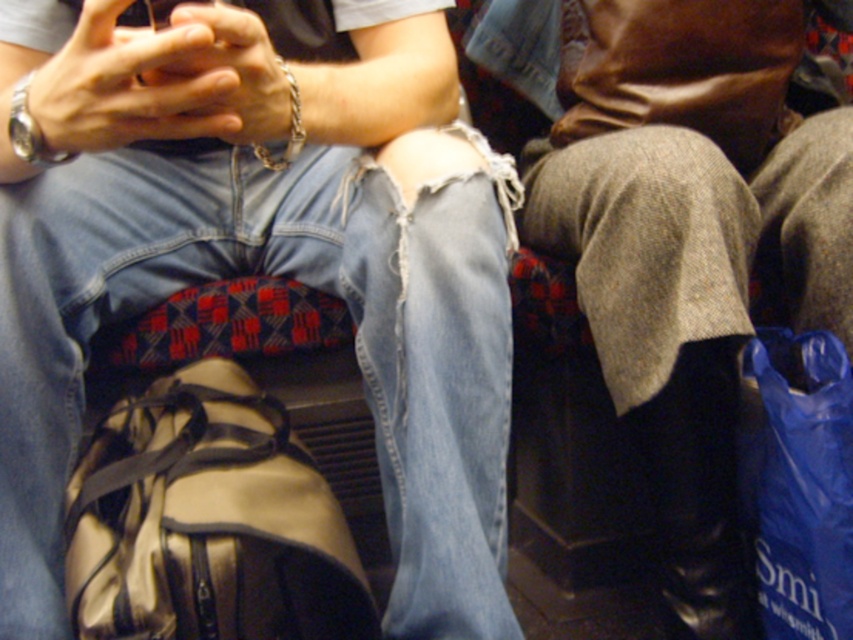
Measure the distance from denim jeans at center to shiny metallic bag at center.

denim jeans at center and shiny metallic bag at center are 5.85 inches apart from each other.

Looking at this image, does denim jeans at center appear on the right side of shiny metallic bag at center?

Indeed, denim jeans at center is positioned on the right side of shiny metallic bag at center.

Who is more forward, (363, 292) or (190, 612)?

Positioned in front is point (190, 612).

This screenshot has height=640, width=853. What are the coordinates of `denim jeans at center` in the screenshot? It's located at (256, 259).

Does shiny metallic bag at center appear on the left side of blue plastic bag at lower right?

Correct, you'll find shiny metallic bag at center to the left of blue plastic bag at lower right.

Which of these two, shiny metallic bag at center or blue plastic bag at lower right, stands taller?

With more height is blue plastic bag at lower right.

Does point (316, 518) come behind point (784, 608)?

No, it is in front of (784, 608).

Locate an element on the screen. shiny metallic bag at center is located at coordinates (207, 522).

Can you confirm if denim jeans at center is positioned to the right of blue plastic bag at lower right?

Incorrect, denim jeans at center is not on the right side of blue plastic bag at lower right.

Where is `denim jeans at center`? The height and width of the screenshot is (640, 853). denim jeans at center is located at coordinates (256, 259).

Locate an element on the screen. The image size is (853, 640). denim jeans at center is located at coordinates (256, 259).